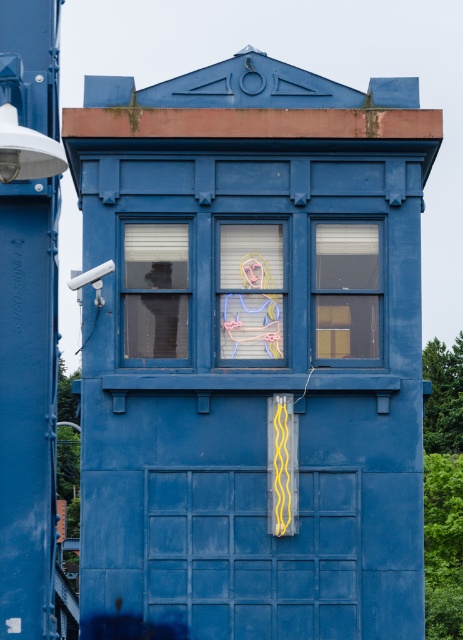
Question: Estimate the real-world distances between objects in this image. Which object is closer to the pastel painted portrait at center?

Choices:
 (A) matte glass window at center right
 (B) matte glass window at center

Answer: (B)

Question: Estimate the real-world distances between objects in this image. Which object is closer to the matte glass window at center right?

Choices:
 (A) pastel painted portrait at center
 (B) matte glass window at center

Answer: (A)

Question: Can you confirm if matte glass window at center is wider than pastel painted portrait at center?

Choices:
 (A) no
 (B) yes

Answer: (B)

Question: Can you confirm if matte glass window at center is positioned to the left of pastel painted portrait at center?

Choices:
 (A) yes
 (B) no

Answer: (A)

Question: Which object appears closest to the camera in this image?

Choices:
 (A) matte glass window at center right
 (B) pastel painted portrait at center

Answer: (A)

Question: Observing the image, what is the correct spatial positioning of matte glass window at center in reference to pastel painted portrait at center?

Choices:
 (A) left
 (B) right

Answer: (A)